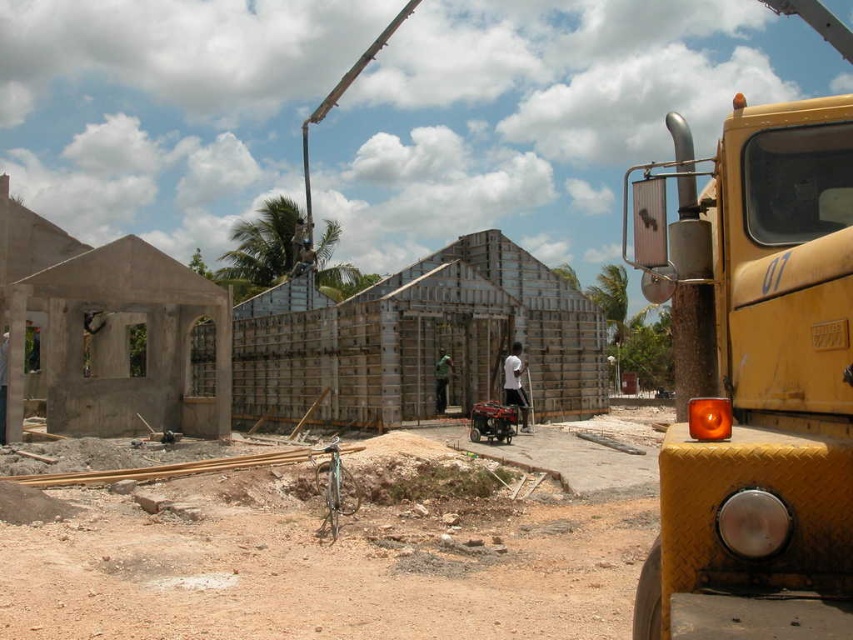
You are a delivery driver who needs to park your truck at the construction site. The yellow metallic school bus at right is already parked. Where should you park your truck so that it doesn not block the entrance? Please provide coordinates in the format of a point between 0 and 1 in x and y axis, with the bottom left corner as the origin.

The yellow metallic school bus at right is parked at point (756, 378). To avoid blocking the entrance, you should park your truck at a location that is not in front of the entrance. Since the entrance is likely near the front of the construction site, which is at the lower part of the image, parking your truck at a point higher up, such as (511, 256), would keep it out of the entrance area.

You are a delivery driver approaching the construction site. You need to navigate around the yellow metallic school bus at right. Which direction should you turn to follow the brown dirt track at center?

You should turn to the left to follow the brown dirt track at center because it is closer to you than the yellow metallic school bus at right, meaning the track is in front and the bus is behind it from your perspective.

You are a delivery driver who needs to drive the yellow metallic school bus at right onto the brown dirt track at center. Based on the scene description, will the school bus fit on the track?

The brown dirt track at center is narrower than the yellow metallic school bus at right, so the bus will not fit on the track.